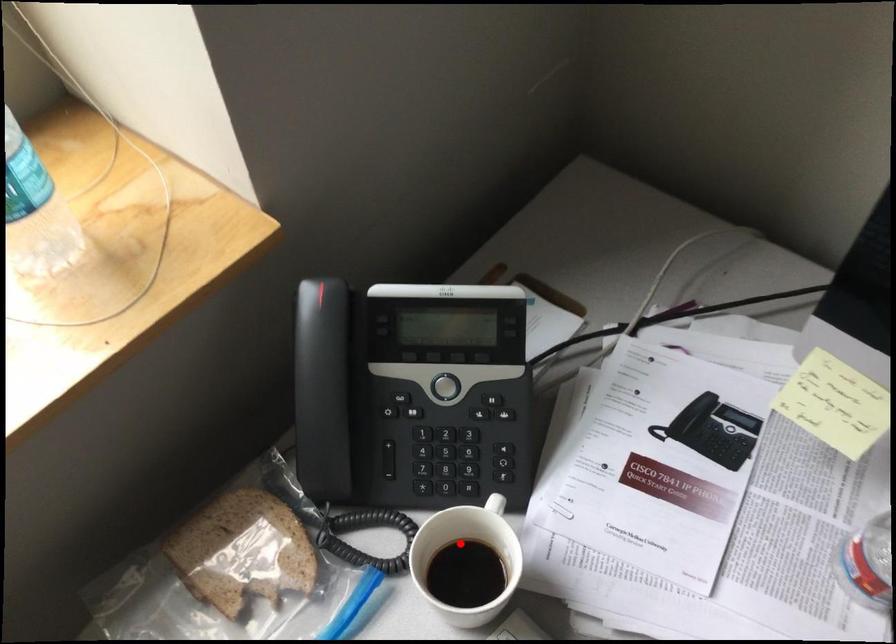
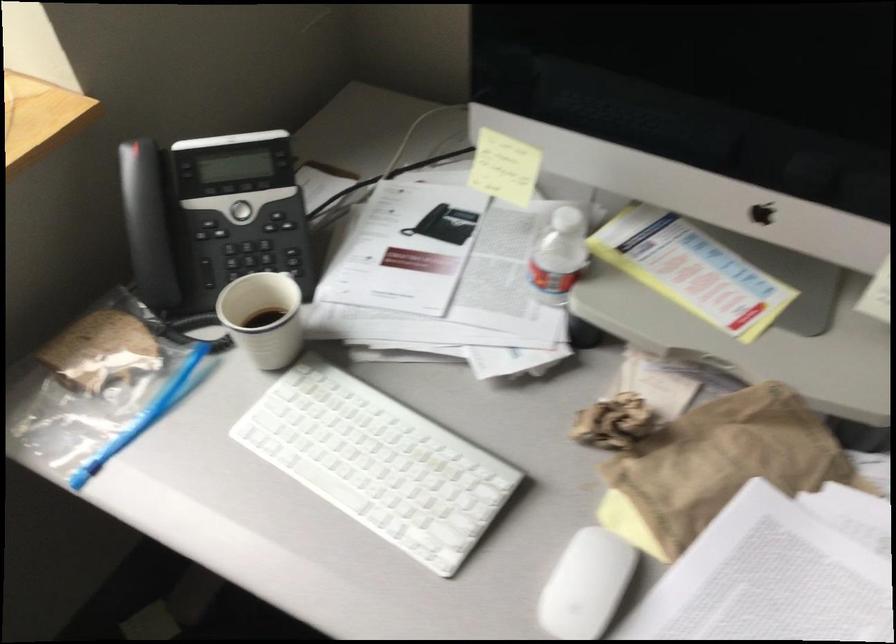
Find the pixel in the second image that matches the highlighted location in the first image.

(263, 317)